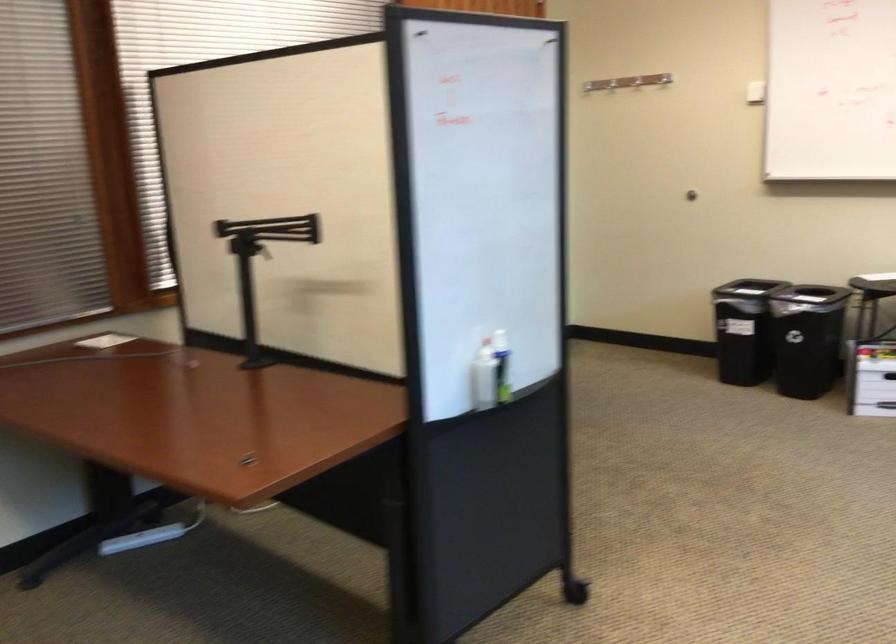
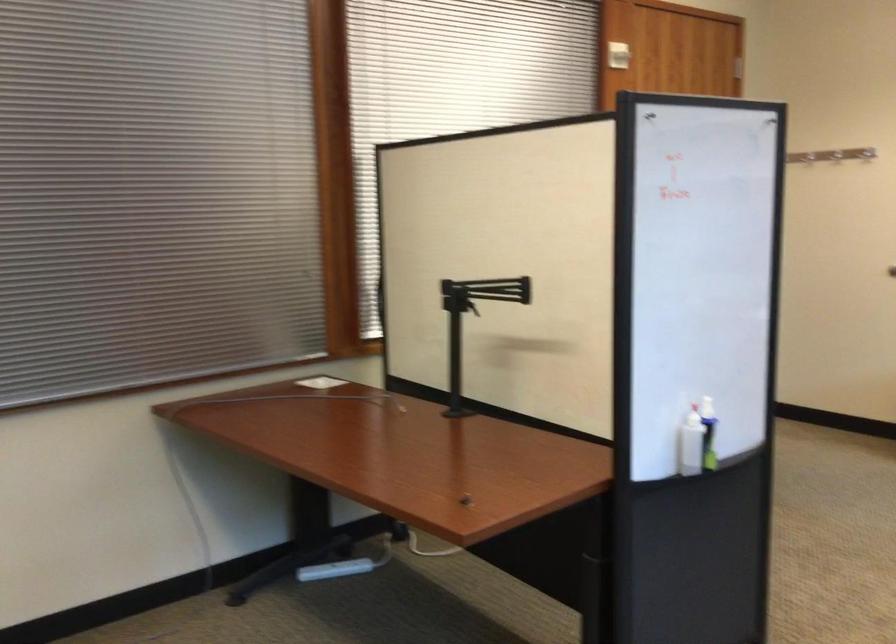
Where in the second image is the point corresponding to point 610,84 from the first image?

(808, 153)